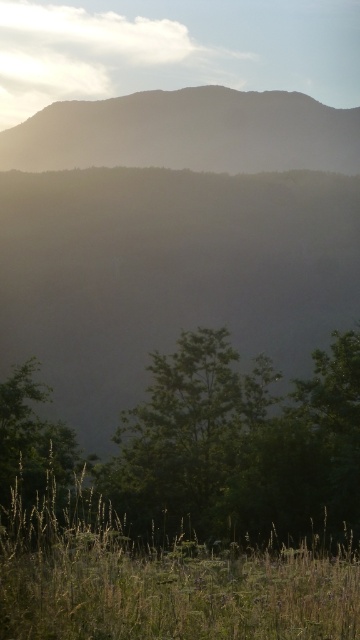
Does silhouetted mountain at upper center appear on the right side of green leafy tree at lower left?

Yes, silhouetted mountain at upper center is to the right of green leafy tree at lower left.

Between point (64, 154) and point (48, 467), which one is positioned in front?

Point (48, 467)

Which is in front, point (194, 282) or point (2, 413)?

Point (2, 413)

I want to click on silhouetted mountain at upper center, so click(173, 237).

Can you confirm if green grassy at lower center is positioned below green leafy tree at lower left?

Indeed, green grassy at lower center is positioned under green leafy tree at lower left.

Between point (225, 589) and point (24, 496), which one is positioned behind?

Positioned behind is point (24, 496).

Who is more forward, (68, 586) or (52, 449)?

Point (68, 586)

Where is `green grassy at lower center`? Image resolution: width=360 pixels, height=640 pixels. green grassy at lower center is located at coordinates (160, 580).

Does silhouetted mountain at upper center appear under green grassy at lower center?

Incorrect, silhouetted mountain at upper center is not positioned below green grassy at lower center.

Is point (308, 282) positioned behind point (303, 589)?

That is True.

This screenshot has width=360, height=640. What do you see at coordinates (173, 237) in the screenshot?
I see `silhouetted mountain at upper center` at bounding box center [173, 237].

Locate an element on the screen. silhouetted mountain at upper center is located at coordinates (173, 237).